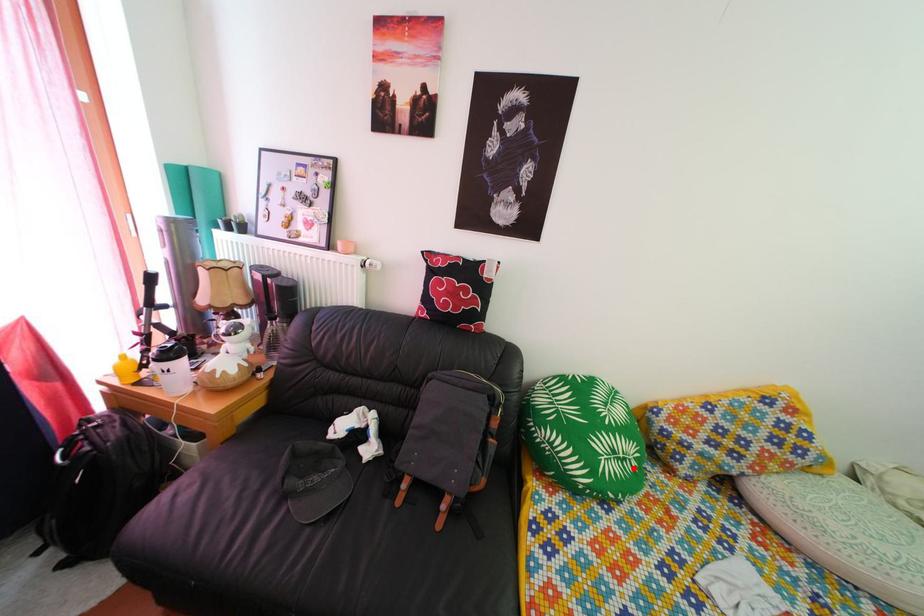
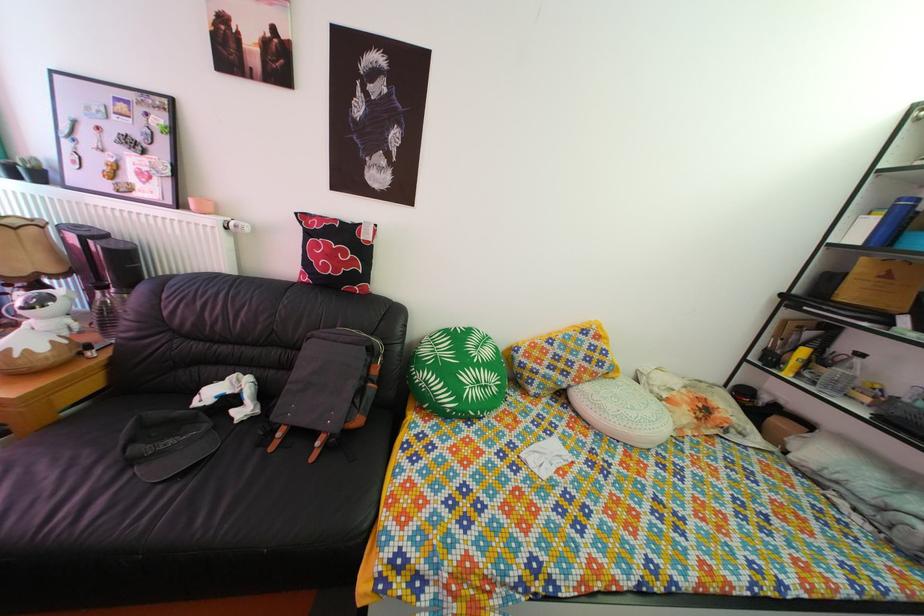
Where in the second image is the point corresponding to the highlighted location from the first image?

(494, 395)